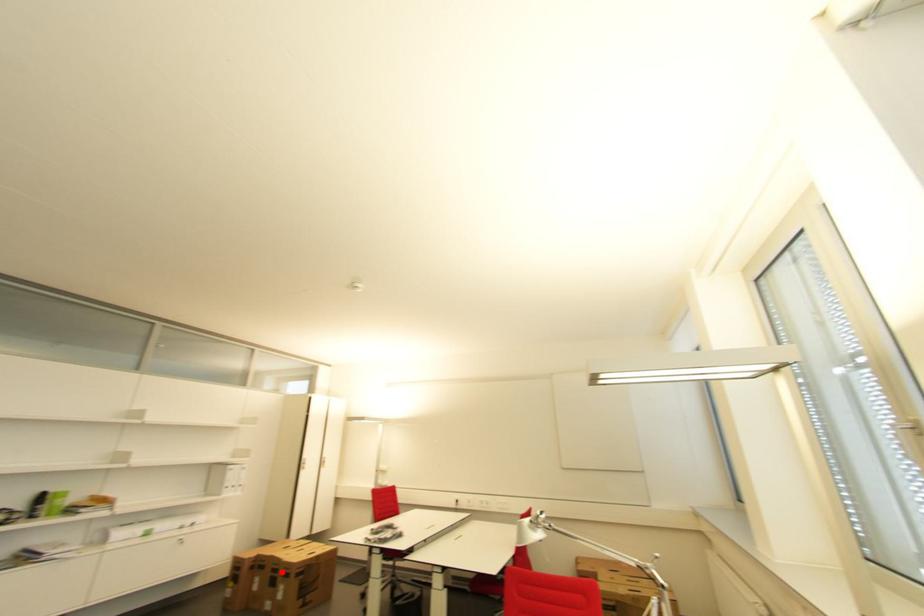
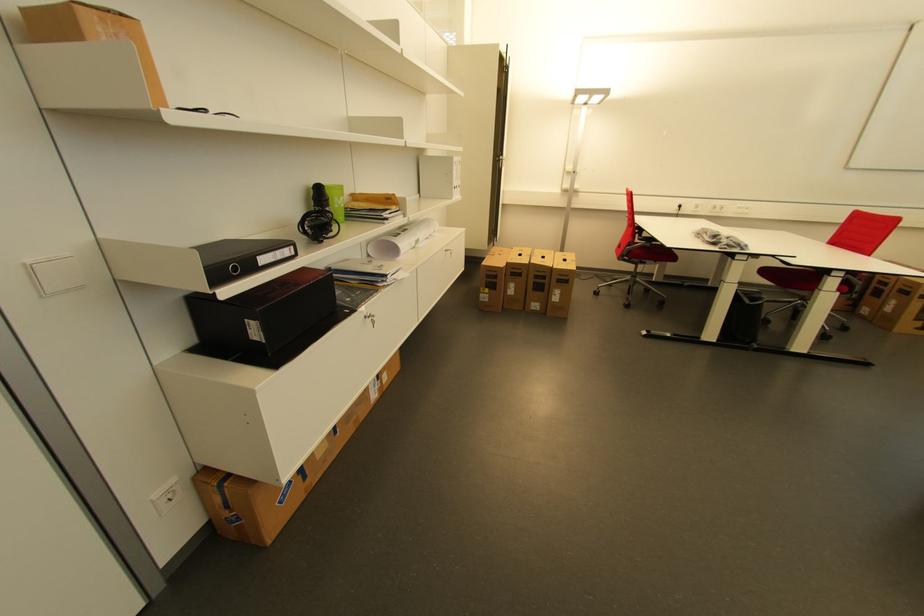
Question: I am providing you with two images of the same scene from different viewpoints. A red point is shown in image1. For the corresponding object point in image2, is it positioned nearer or farther from the camera?

Choices:
 (A) Nearer
 (B) Farther

Answer: (A)